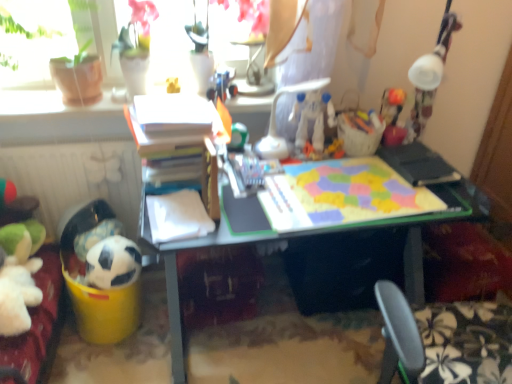
Describe the element at coordinates (113, 263) in the screenshot. I see `white matte soccer ball at lower left` at that location.

Describe the element at coordinates (173, 85) in the screenshot. The width and height of the screenshot is (512, 384). I see `yellow matte toy at upper center, which is counted as the 4th toy, starting from the bottom` at that location.

How much space does yellow matte toy at upper center, which ranks as the 1th toy in top-to-bottom order, occupy vertically?

It is 3.55 inches.

What do you see at coordinates (275, 121) in the screenshot?
I see `white plastic chair at center` at bounding box center [275, 121].

Locate an element on the screen. The image size is (512, 384). white matte radiator at lower left is located at coordinates (77, 178).

What is the approximate width of green matte ball at center, positioned as the 3th toy in top-to-bottom order?

It is 6.81 centimeters.

I want to click on matte plastic desk at center, so click(x=176, y=274).

I want to click on desk located on the right of white plastic chair at center, so pos(176,274).

Considering their positions, is matte plastic desk at center located in front of or behind white plastic chair at center?

Clearly, matte plastic desk at center is in front of white plastic chair at center.

Is matte plastic desk at center to the right of white plastic chair at center from the viewer's perspective?

Indeed, matte plastic desk at center is positioned on the right side of white plastic chair at center.

Considering the relative sizes of matte plastic desk at center and white plastic chair at center in the image provided, is matte plastic desk at center bigger than white plastic chair at center?

Correct, matte plastic desk at center is larger in size than white plastic chair at center.

You are a GUI agent. You are given a task and a screenshot of the screen. Output one action in this format:
    pyautogui.click(x=<x>, y=<y>)
    Task: Click on the animal located underneath the white matte radiator at lower left (from a real-world perspective)
    This screenshot has height=384, width=512.
    Given the screenshot: What is the action you would take?
    pyautogui.click(x=113, y=263)

Considering the sizes of objects white matte radiator at lower left and white matte soccer ball at lower left in the image provided, who is taller, white matte radiator at lower left or white matte soccer ball at lower left?

Standing taller between the two is white matte radiator at lower left.

Is white matte radiator at lower left outside of white matte soccer ball at lower left?

Yes, white matte radiator at lower left is not within white matte soccer ball at lower left.

Which is in front, white matte radiator at lower left or white matte soccer ball at lower left?

white matte soccer ball at lower left.

Who is smaller, matte plastic desk at center or white matte soccer ball at lower left, the fourth toy positioned from the top?

With smaller size is white matte soccer ball at lower left, the fourth toy positioned from the top.

Which of these two, matte plastic desk at center or white matte soccer ball at lower left, the first toy ordered from the bottom, is wider?

matte plastic desk at center.

How different are the orientations of matte plastic desk at center and white matte soccer ball at lower left, which is the first toy in left-to-right order, in degrees?

matte plastic desk at center and white matte soccer ball at lower left, which is the first toy in left-to-right order, are facing 3.44 degrees away from each other.

Is white matte radiator at lower left beside yellow matte toy at upper center, which is counted as the 4th toy, starting from the bottom?

No, white matte radiator at lower left is not touching yellow matte toy at upper center, which is counted as the 4th toy, starting from the bottom.

I want to click on radiator located in front of the yellow matte toy at upper center, marked as the 2th toy in a left-to-right arrangement, so click(77, 178).

Between white matte radiator at lower left and yellow matte toy at upper center, marked as the 2th toy in a left-to-right arrangement, which one is positioned in front?

Positioned in front is white matte radiator at lower left.

Which of these two, white matte radiator at lower left or yellow matte toy at upper center, which ranks as the 1th toy in top-to-bottom order, is thinner?

yellow matte toy at upper center, which ranks as the 1th toy in top-to-bottom order, is thinner.

Can we say yellow matte toy at upper center, marked as the 2th toy in a left-to-right arrangement, lies outside white matte radiator at lower left?

Yes.

Between yellow matte toy at upper center, marked as the 3th toy in a right-to-left arrangement, and white matte radiator at lower left, which one has less height?

With less height is yellow matte toy at upper center, marked as the 3th toy in a right-to-left arrangement.

From the picture: Is the surface of yellow matte toy at upper center, which ranks as the 1th toy in top-to-bottom order, in direct contact with white matte radiator at lower left?

→ No.

Would you say white plastic robot at center, which ranks as the third toy in bottom-to-top order, is inside or outside yellow matte toy at upper center, which is counted as the 4th toy, starting from the bottom?

white plastic robot at center, which ranks as the third toy in bottom-to-top order, exists outside the volume of yellow matte toy at upper center, which is counted as the 4th toy, starting from the bottom.

Does white plastic robot at center, marked as the second toy in a top-to-bottom arrangement, turn towards yellow matte toy at upper center, marked as the 3th toy in a right-to-left arrangement?

No, white plastic robot at center, marked as the second toy in a top-to-bottom arrangement, is not aimed at yellow matte toy at upper center, marked as the 3th toy in a right-to-left arrangement.

Find the location of a particular element. the 2nd toy behind the white plastic robot at center, marked as the second toy in a top-to-bottom arrangement is located at coordinates (173, 85).

Is white plastic robot at center, which ranks as the third toy in bottom-to-top order, smaller than yellow matte toy at upper center, which ranks as the 1th toy in top-to-bottom order?

Actually, white plastic robot at center, which ranks as the third toy in bottom-to-top order, might be larger than yellow matte toy at upper center, which ranks as the 1th toy in top-to-bottom order.

How different are the orientations of white matte soccer ball at lower left, which is the first toy in left-to-right order, and green matte ball at center, the third toy from the left, in degrees?

The facing directions of white matte soccer ball at lower left, which is the first toy in left-to-right order, and green matte ball at center, the third toy from the left, are 0.00174 degrees apart.

Could green matte ball at center, positioned as the 3th toy in top-to-bottom order, be considered to be inside white matte soccer ball at lower left, which ranks as the fourth toy in right-to-left order?

No, white matte soccer ball at lower left, which ranks as the fourth toy in right-to-left order, does not contain green matte ball at center, positioned as the 3th toy in top-to-bottom order.

From the image's perspective, relative to green matte ball at center, positioned as the 3th toy in top-to-bottom order, is white matte soccer ball at lower left, the fourth toy positioned from the top, above or below?

From the image's perspective, white matte soccer ball at lower left, the fourth toy positioned from the top, appears below green matte ball at center, positioned as the 3th toy in top-to-bottom order.

Between white matte soccer ball at lower left, the first toy ordered from the bottom, and green matte ball at center, positioned as the second toy in right-to-left order, which one has larger width?

white matte soccer ball at lower left, the first toy ordered from the bottom.

I want to click on desk lying in front of the white plastic chair at center, so click(x=176, y=274).

Identify the location of animal that is below the white matte radiator at lower left (from the image's perspective). Image resolution: width=512 pixels, height=384 pixels. (113, 263).

Based on their spatial positions, is white matte soccer ball at lower left or white matte soccer ball at lower left, the first toy ordered from the bottom, closer to yellow matte toy at upper center, marked as the 3th toy in a right-to-left arrangement?

white matte soccer ball at lower left is closer to yellow matte toy at upper center, marked as the 3th toy in a right-to-left arrangement.

Based on the photo, estimate the real-world distances between objects in this image. Which object is closer to white matte radiator at lower left, green matte ball at center, positioned as the second toy in right-to-left order, or white plastic chair at center?

green matte ball at center, positioned as the second toy in right-to-left order, lies closer to white matte radiator at lower left than the other object.

From the image, which object appears to be farther from white plastic robot at center, which ranks as the third toy in bottom-to-top order, white matte soccer ball at lower left or white matte soccer ball at lower left, which is the first toy in left-to-right order?

white matte soccer ball at lower left, which is the first toy in left-to-right order, lies further to white plastic robot at center, which ranks as the third toy in bottom-to-top order, than the other object.

When comparing their distances from white plastic chair at center, does matte plastic desk at center or green matte ball at center, positioned as the second toy in right-to-left order, seem further?

Based on the image, matte plastic desk at center appears to be further to white plastic chair at center.

Based on their spatial positions, is white matte soccer ball at lower left, the fourth toy positioned from the top, or matte plastic desk at center further from white matte soccer ball at lower left?

matte plastic desk at center is positioned further to the anchor white matte soccer ball at lower left.

Estimate the real-world distances between objects in this image. Which object is further from white plastic chair at center, white plastic robot at center, positioned as the 1th toy in right-to-left order, or white matte soccer ball at lower left?

The object further to white plastic chair at center is white matte soccer ball at lower left.

Which object lies further to the anchor point white matte soccer ball at lower left, which ranks as the fourth toy in right-to-left order, white plastic robot at center, positioned as the 1th toy in right-to-left order, or yellow matte toy at upper center, marked as the 3th toy in a right-to-left arrangement?

white plastic robot at center, positioned as the 1th toy in right-to-left order, is positioned further to the anchor white matte soccer ball at lower left, which ranks as the fourth toy in right-to-left order.

Estimate the real-world distances between objects in this image. Which object is further from green matte ball at center, positioned as the 3th toy in top-to-bottom order, yellow matte toy at upper center, marked as the 3th toy in a right-to-left arrangement, or white plastic chair at center?

The object further to green matte ball at center, positioned as the 3th toy in top-to-bottom order, is yellow matte toy at upper center, marked as the 3th toy in a right-to-left arrangement.

Identify the location of chair between white plastic robot at center, positioned as the 1th toy in right-to-left order, and matte plastic desk at center in the up-down direction. (275, 121).

Where is `chair between white matte soccer ball at lower left, which is the first toy in left-to-right order, and matte plastic desk at center`? Image resolution: width=512 pixels, height=384 pixels. chair between white matte soccer ball at lower left, which is the first toy in left-to-right order, and matte plastic desk at center is located at coordinates (275, 121).

Locate an element on the screen. Image resolution: width=512 pixels, height=384 pixels. animal between green matte ball at center, which ranks as the 2th toy in bottom-to-top order, and white matte soccer ball at lower left, the first toy ordered from the bottom, in the up-down direction is located at coordinates (113, 263).

The height and width of the screenshot is (384, 512). Find the location of `radiator between yellow matte toy at upper center, marked as the 2th toy in a left-to-right arrangement, and white matte soccer ball at lower left, in the vertical direction`. radiator between yellow matte toy at upper center, marked as the 2th toy in a left-to-right arrangement, and white matte soccer ball at lower left, in the vertical direction is located at coordinates (77, 178).